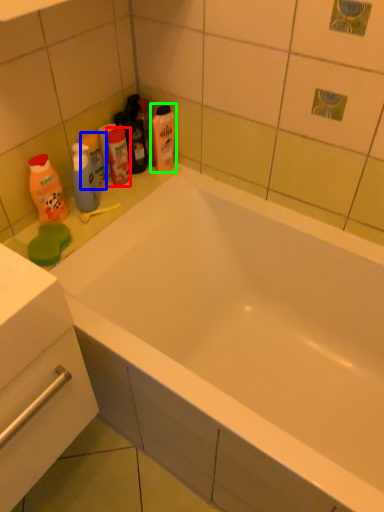
Question: Considering the real-world distances, which object is closest to mouthwash (highlighted by a red box)? mouthwash (highlighted by a blue box) or cleaning product (highlighted by a green box).

Choices:
 (A) mouthwash
 (B) cleaning product

Answer: (A)